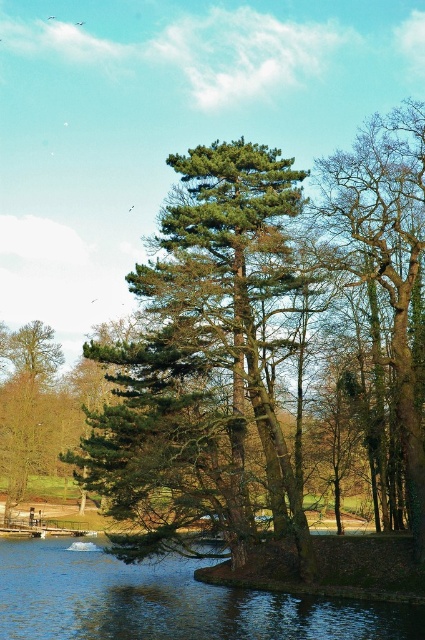
Consider the image. Is blue reflective water at lower center bigger than brown rough tree at left?

Yes.

Does blue reflective water at lower center have a greater height compared to brown rough tree at left?

Incorrect, blue reflective water at lower center's height is not larger of brown rough tree at left's.

Where is `blue reflective water at lower center`? This screenshot has width=425, height=640. blue reflective water at lower center is located at coordinates (167, 602).

The width and height of the screenshot is (425, 640). What do you see at coordinates (203, 362) in the screenshot?
I see `green textured tree at center` at bounding box center [203, 362].

Is point (207, 211) positioned in front of point (402, 384)?

No, (207, 211) is further to viewer.

Where is `green textured tree at center`? green textured tree at center is located at coordinates click(203, 362).

Based on the photo, who is lower down, blue reflective water at lower center or brown textured tree at right?

blue reflective water at lower center is lower down.

Between blue reflective water at lower center and brown textured tree at right, which one has more height?

Standing taller between the two is brown textured tree at right.

Find the location of a particular element. The height and width of the screenshot is (640, 425). blue reflective water at lower center is located at coordinates (167, 602).

Find the location of a particular element. blue reflective water at lower center is located at coordinates (167, 602).